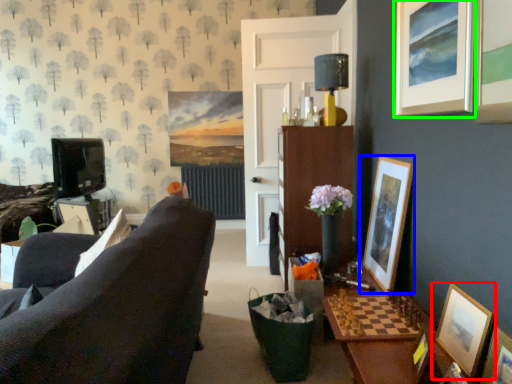
Question: Which is farther away from picture frame (highlighted by a red box)? picture frame (highlighted by a blue box) or picture frame (highlighted by a green box)?

Choices:
 (A) picture frame
 (B) picture frame

Answer: (B)